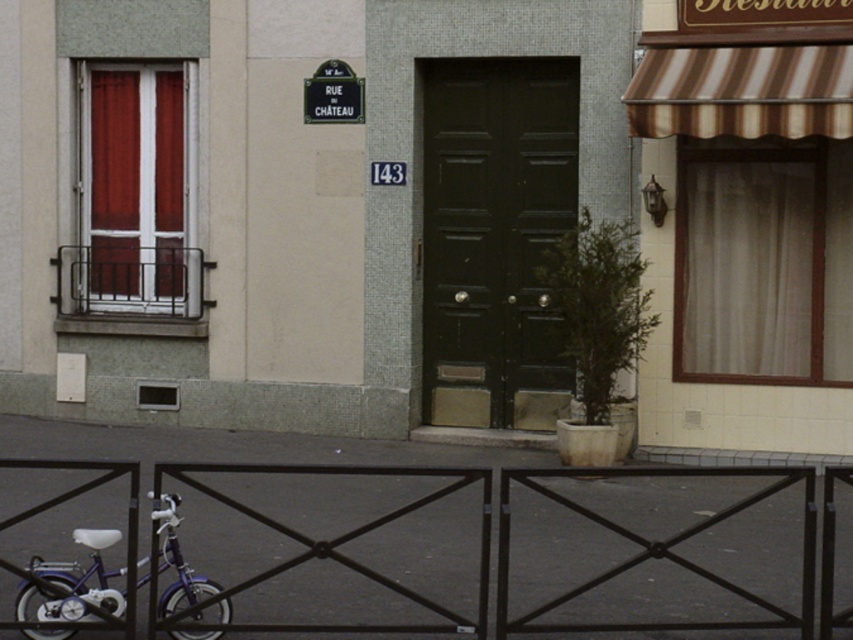
Which is in front, point (825, 544) or point (350, 74)?

Point (825, 544) is in front.

Image resolution: width=853 pixels, height=640 pixels. In order to click on black metal fence at lower center in this screenshot , I will do pos(527,554).

The width and height of the screenshot is (853, 640). Describe the element at coordinates (527, 554) in the screenshot. I see `black metal fence at lower center` at that location.

Locate an element on the screen. black metal fence at lower center is located at coordinates (527, 554).

Is shiny purple bicycle at lower left taller than green metal sign at upper center?

Yes, shiny purple bicycle at lower left is taller than green metal sign at upper center.

Who is positioned more to the right, shiny purple bicycle at lower left or green metal sign at upper center?

From the viewer's perspective, green metal sign at upper center appears more on the right side.

Image resolution: width=853 pixels, height=640 pixels. What are the coordinates of `shiny purple bicycle at lower left` in the screenshot? It's located at (73, 582).

Which of these two, black metal fence at lower center or shiny purple bicycle at lower left, stands taller?

With more height is shiny purple bicycle at lower left.

Is point (766, 516) positioned behind point (86, 529)?

Yes, it is.

I want to click on black metal fence at lower center, so click(527, 554).